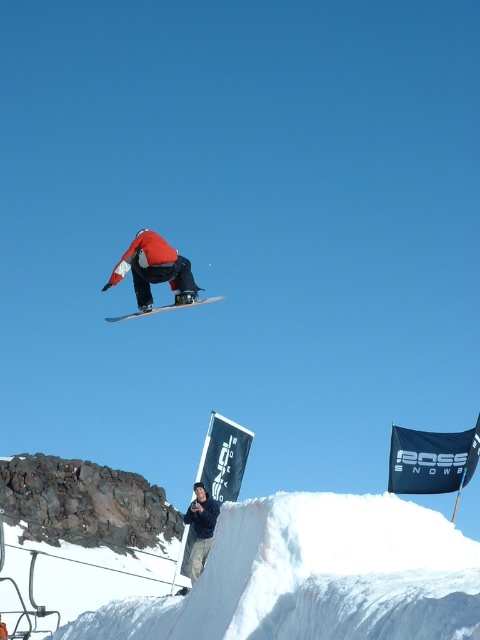
You are standing at the base of the snowboard ramp and want to reach a point that is 144.62 feet away from you. Is the point at coordinates point [103,289] the one you should aim for?

Yes, the point at point [103,289] is 144.62 feet away from the viewer, so it is the correct point to aim for.

You are a photographer at the snowboarding event. You need to capture a photo of both the matte red snowboarder at center and the white matte snowboard at center. Which object should you focus on first if you want to capture them in the same frame without moving the camera?

The matte red snowboarder at center is to the left of the white matte snowboard at center, so you should focus on the matte red snowboarder at center first to ensure both are in the frame without moving the camera.

You are a photographer at the snowboarding event. You want to capture a photo where the matte red snowboarder at center is clearly visible against the white matte snowboard at center. Considering their sizes, which object would appear smaller in the photo?

The matte red snowboarder at center would appear smaller in the photo because it has a lesser width compared to the white matte snowboard at center.